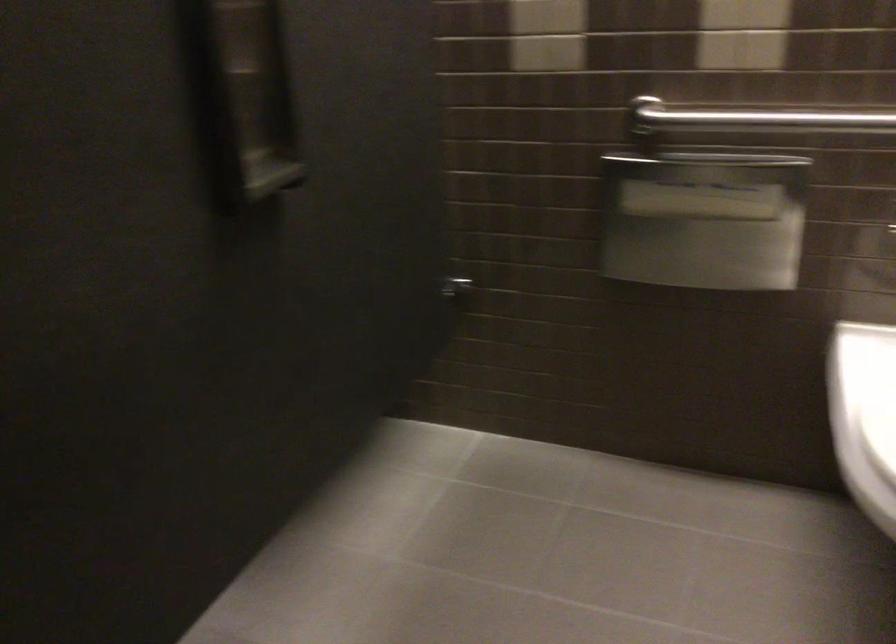
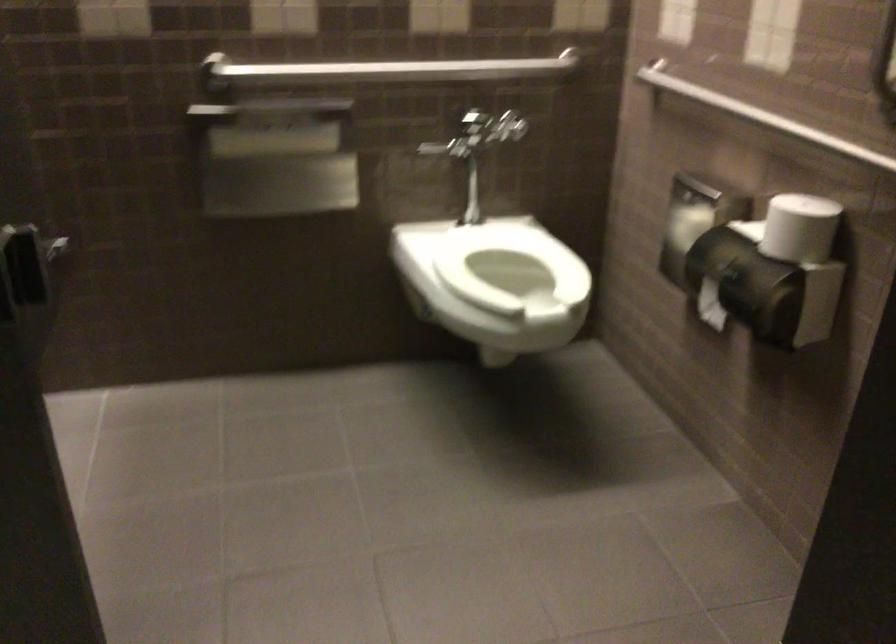
Question: The camera is either moving clockwise (left) or counter-clockwise (right) around the object. The first image is from the beginning of the video and the second image is from the end. Is the camera moving left or right when shooting the video?

Choices:
 (A) Left
 (B) Right

Answer: (A)